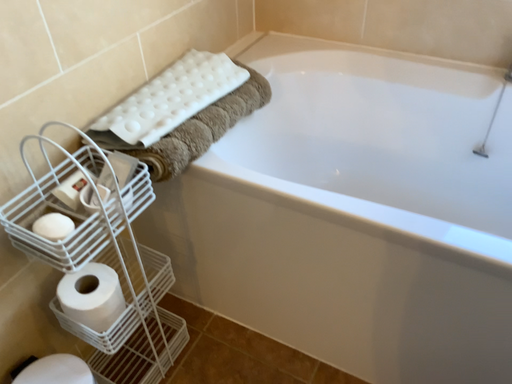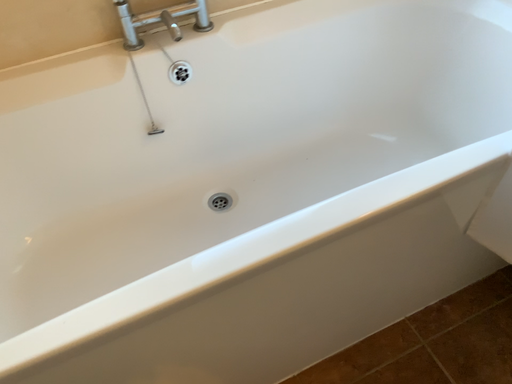
Question: How did the camera likely rotate when shooting the video?

Choices:
 (A) rotated left
 (B) rotated right

Answer: (B)